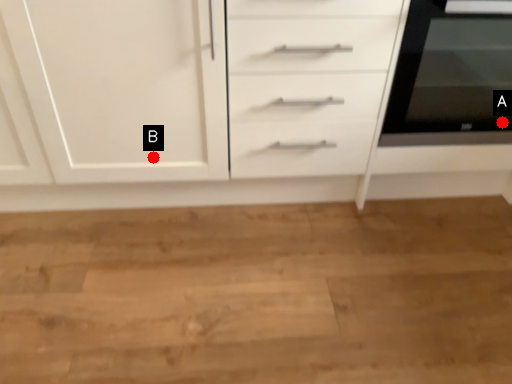
Question: Two points are circled on the image, labeled by A and B beside each circle. Which of the following is the farthest from the observer?

Choices:
 (A) A is further
 (B) B is further

Answer: (A)